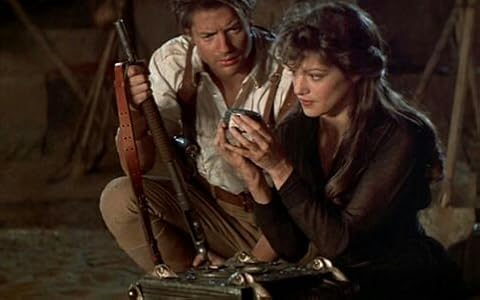
At what (x,y) coordinates should I click in order to perform the action: click on floor next to people. Please return your answer as a coordinate pair (x, y). Looking at the image, I should click on (60, 273).